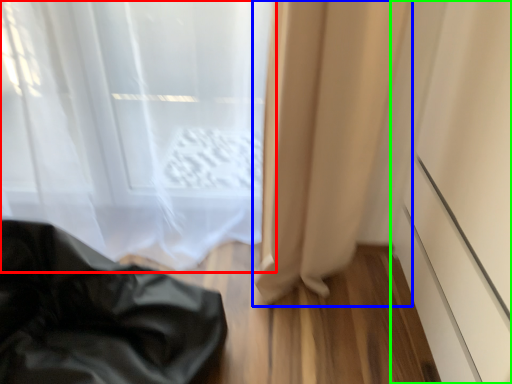
Question: Considering the real-world distances, which object is closest to curtain (highlighted by a red box)? curtain (highlighted by a blue box) or screen door (highlighted by a green box).

Choices:
 (A) curtain
 (B) screen door

Answer: (A)